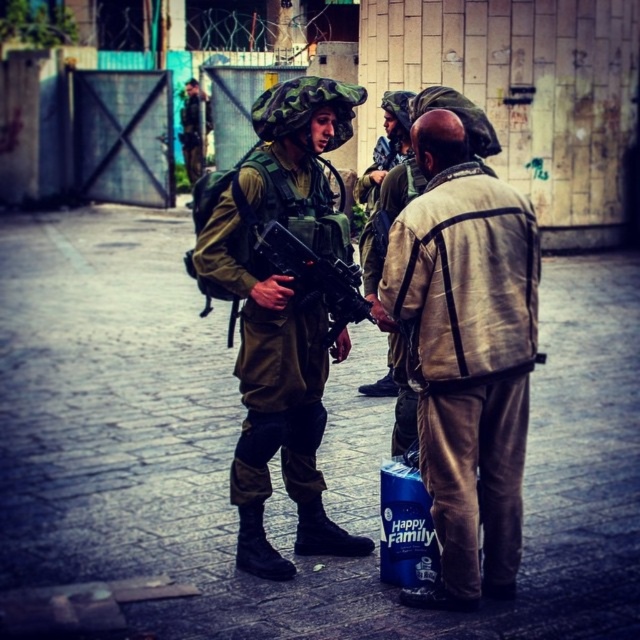
You are a fashion designer observing the scene. You need to create a new line of clothing that accommodates both the tan fabric jacket at center and the camouflage fabric uniform at center. Which garment has a wider silhouette to consider in your design?

The camouflage fabric uniform at center has a wider silhouette than the tan fabric jacket at center, so it should be the primary consideration for accommodating width in the design.

Where is the tan fabric jacket at center located in the image?

The tan fabric jacket at center is located at the 2D coordinates point (467, 355) in the image.

You are a military analyst observing the scene. You need to determine the spatial relationship between the matte black rifle at center and the camouflage uniform at upper left. Which object is positioned higher in the image?

The camouflage uniform at upper left is positioned higher in the image than the matte black rifle at center, as the rifle is located below it.